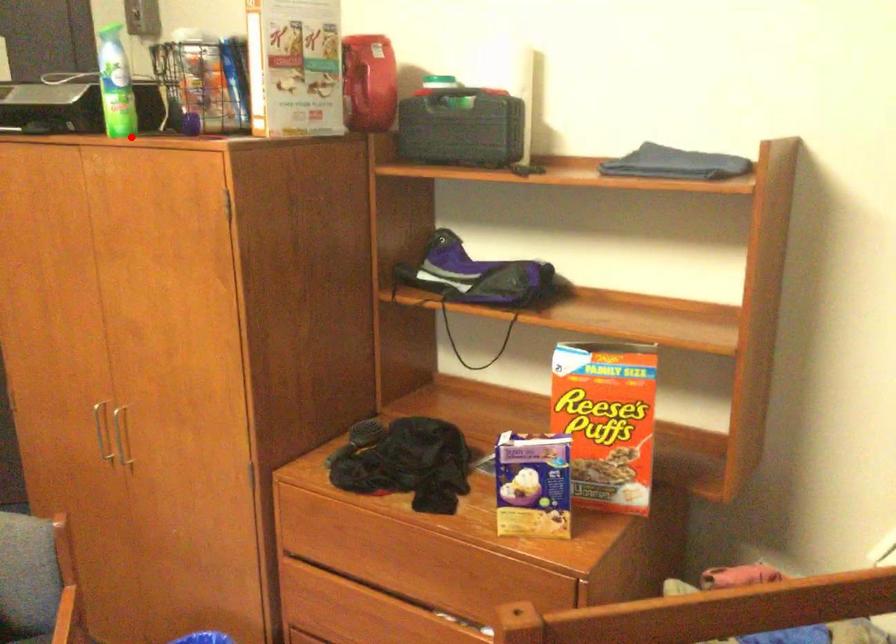
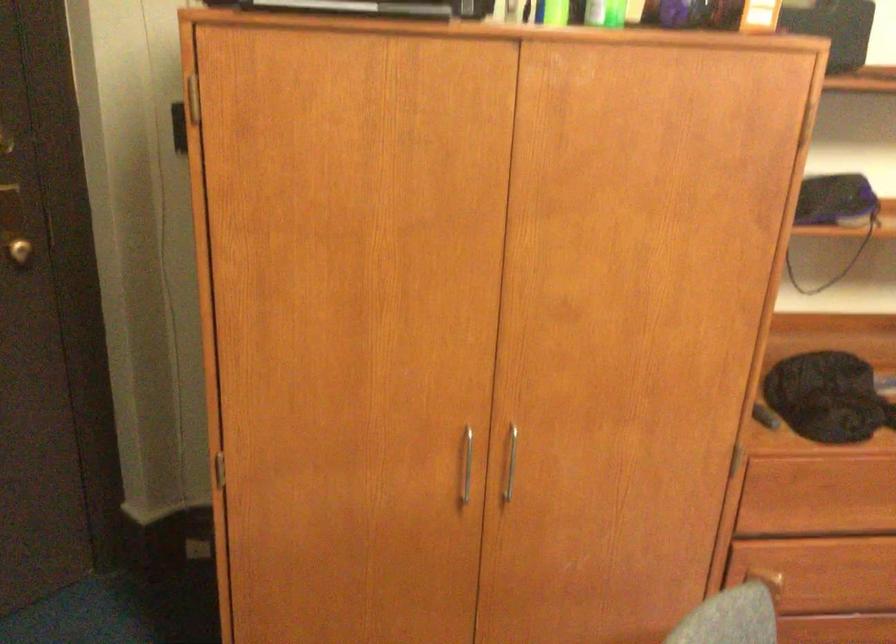
Question: A red point is marked in image1. In image2, is the corresponding 3D point closer to the camera or farther? Reply with the corresponding letter.

Choices:
 (A) The corresponding 3D point is closer.
 (B) The corresponding 3D point is farther.

Answer: (A)